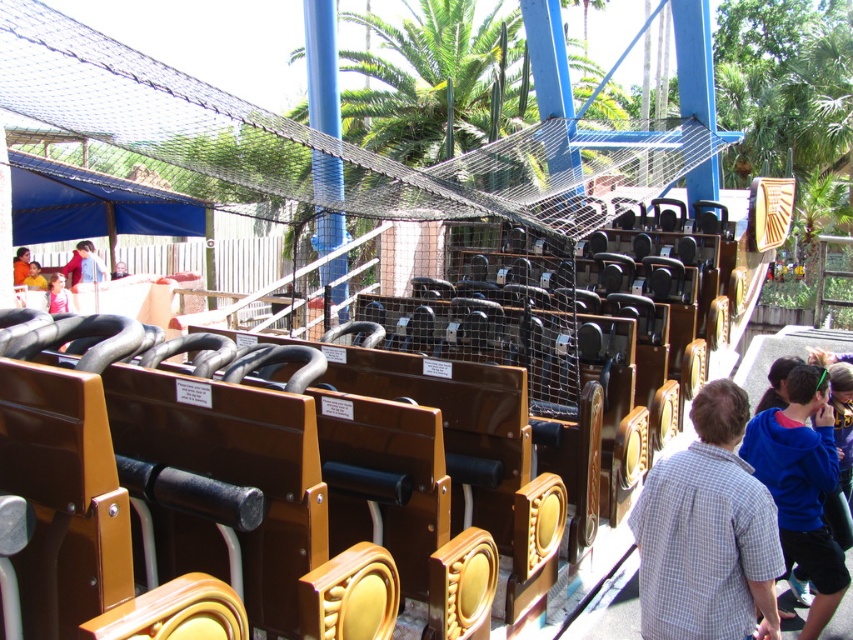
Question: Which object appears closest to the camera in this image?

Choices:
 (A) blue fleece jacket at lower right
 (B) blue denim jacket at left
 (C) pink fabric shirt at upper left
 (D) orange shirt at lower left

Answer: (A)

Question: Does pink fabric shirt at upper left have a larger size compared to orange shirt at lower left?

Choices:
 (A) yes
 (B) no

Answer: (B)

Question: Among these objects, which one is nearest to the camera?

Choices:
 (A) pink fabric shirt at upper left
 (B) white checkered shirt at center
 (C) blue fleece jacket at lower right

Answer: (B)

Question: Does pink fabric shirt at upper left appear over yellow shirt at lower left?

Choices:
 (A) no
 (B) yes

Answer: (A)

Question: Which of the following is the closest to the observer?

Choices:
 (A) white checkered shirt at center
 (B) pink fabric shirt at upper left

Answer: (A)

Question: In this image, where is blue denim jacket at left located relative to orange shirt at lower left?

Choices:
 (A) below
 (B) above

Answer: (B)